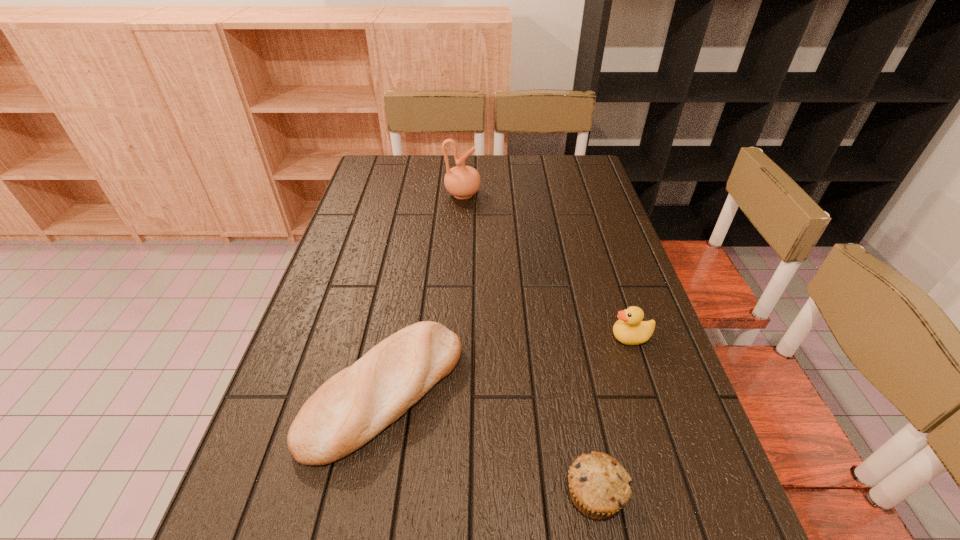
At what (x,y) coordinates should I click in order to perform the action: click on vacant space that's between the tallest object and the bread. Please return your answer as a coordinate pair (x, y). The width and height of the screenshot is (960, 540). Looking at the image, I should click on (423, 293).

At what (x,y) coordinates should I click in order to perform the action: click on unoccupied position between the tallest object and the bread. Please return your answer as a coordinate pair (x, y). The width and height of the screenshot is (960, 540). Looking at the image, I should click on (423, 293).

The image size is (960, 540). I want to click on empty location between the pottery and the rightmost object, so click(x=547, y=266).

This screenshot has width=960, height=540. I want to click on unoccupied area between the farthest object and the rightmost object, so click(x=547, y=266).

At what (x,y) coordinates should I click in order to perform the action: click on free space between the pottery and the bread. Please return your answer as a coordinate pair (x, y). This screenshot has height=540, width=960. Looking at the image, I should click on (423, 293).

Image resolution: width=960 pixels, height=540 pixels. Identify the location of free area in between the bread and the rightmost object. (508, 364).

Identify the location of vacant space in between the tallest object and the third object from left to right. The width and height of the screenshot is (960, 540). (529, 344).

The width and height of the screenshot is (960, 540). In order to click on free space between the duck and the farthest object in this screenshot , I will do `click(547, 266)`.

Identify which object is located as the second nearest to the bread. Please provide its 2D coordinates. Your answer should be formatted as a tuple, i.e. [(x, y)], where the tuple contains the x and y coordinates of a point satisfying the conditions above.

[(630, 329)]

Select which object is the closest to the bread. Please provide its 2D coordinates. Your answer should be formatted as a tuple, i.e. [(x, y)], where the tuple contains the x and y coordinates of a point satisfying the conditions above.

[(599, 486)]